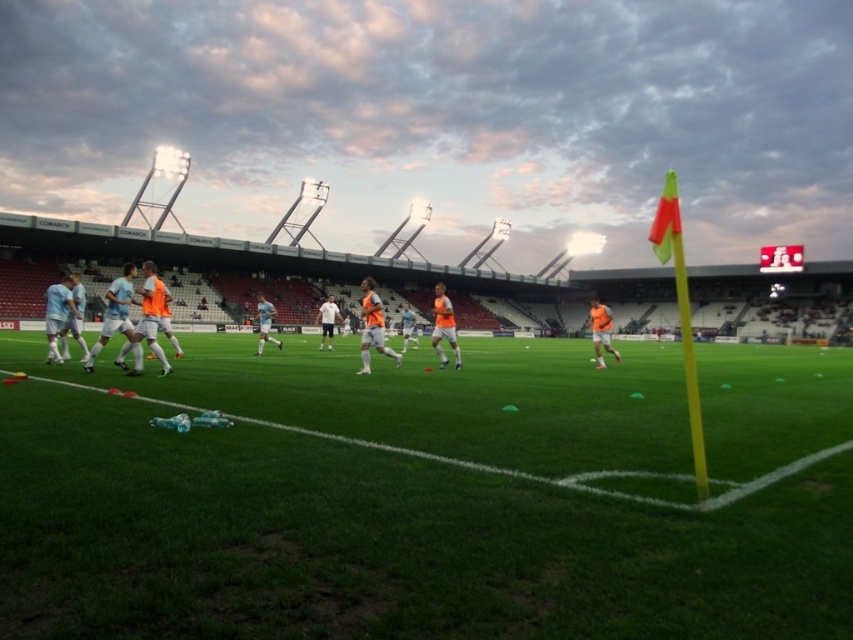
Is orange fabric jersey at center smaller than orange mesh vest at center?

Correct, orange fabric jersey at center occupies less space than orange mesh vest at center.

Does orange fabric jersey at center have a larger size compared to orange mesh vest at center?

No, orange fabric jersey at center is not bigger than orange mesh vest at center.

Is point (376, 296) positioned before point (457, 365)?

That is True.

You are a GUI agent. You are given a task and a screenshot of the screen. Output one action in this format:
    pyautogui.click(x=<x>, y=<y>)
    Task: Click on the orange fabric jersey at center
    The height and width of the screenshot is (640, 853).
    Given the screenshot: What is the action you would take?
    pyautogui.click(x=372, y=326)

Can you confirm if green grass at center is positioned to the right of orange fabric jersey at center?

Incorrect, green grass at center is not on the right side of orange fabric jersey at center.

Can you confirm if green grass at center is shorter than orange fabric jersey at center?

Correct, green grass at center is not as tall as orange fabric jersey at center.

Does point (341, 598) come in front of point (387, 353)?

Yes, point (341, 598) is closer to viewer.

Where is `green grass at center`? green grass at center is located at coordinates (376, 540).

Which is more to the left, green grass at center or orange matte jersey at right?

green grass at center

Is point (379, 416) positioned before point (604, 339)?

Yes, point (379, 416) is closer to viewer.

Between point (323, 525) and point (602, 305), which one is positioned in front?

Point (323, 525) is more forward.

Identify the location of green grass at center. (376, 540).